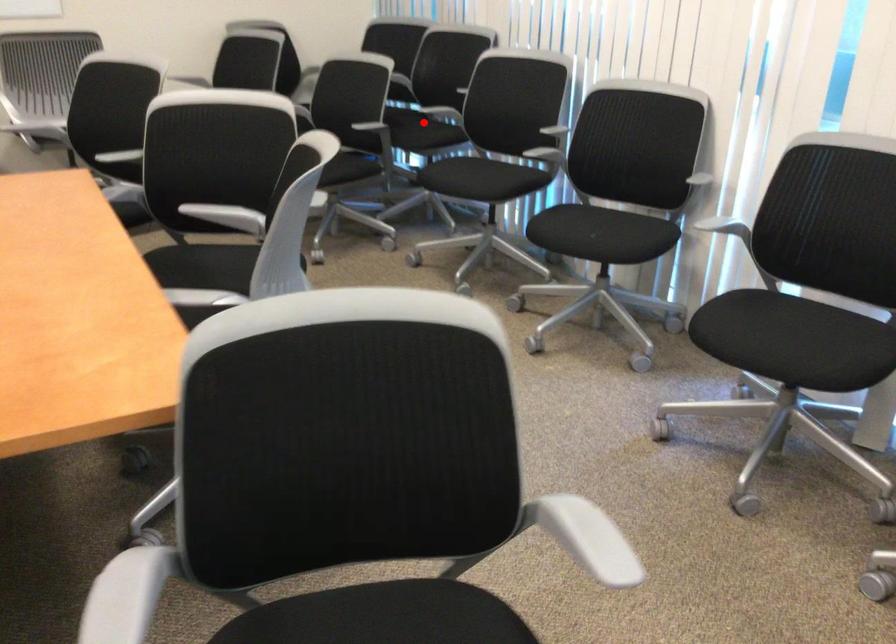
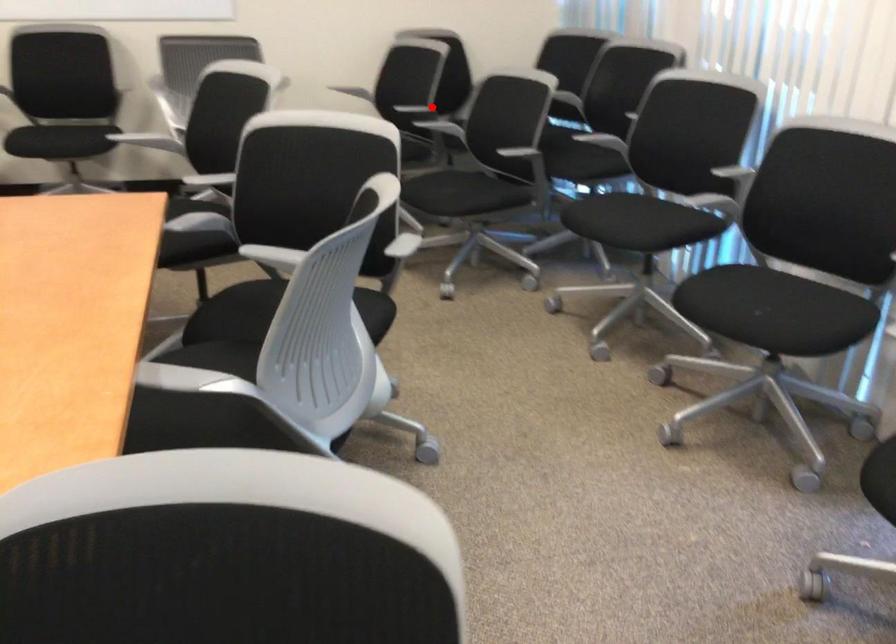
I am providing you with two images of the same scene from different viewpoints. A red point is marked on the first image and another point is marked on the second image. Are the points marked in image1 and image2 representing the same 3D position?

No